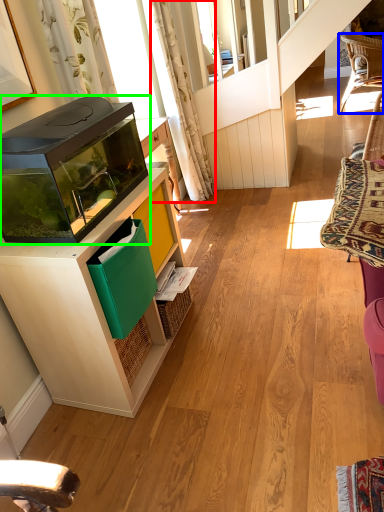
Question: Based on their relative distances, which object is nearer to curtain (highlighted by a red box)? Choose from chair (highlighted by a blue box) and appliance (highlighted by a green box).

Choices:
 (A) chair
 (B) appliance

Answer: (B)